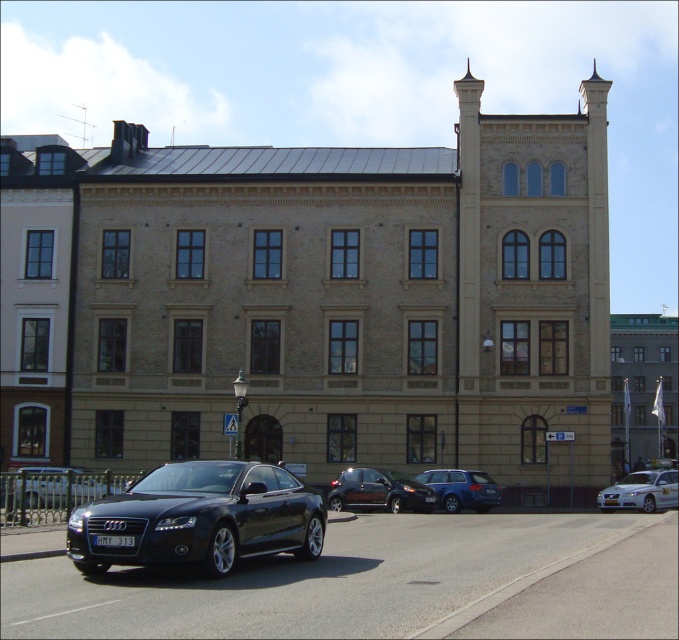
In the scene shown: You are standing in front of the building and want to take a photo. You notice two points marked on the building wall. The first point is at coordinates point (52, 497) and the second is at point (458, 481). Which point will appear larger in your photo?

The point at point (52, 497) will appear larger in the photo because it is closer to the camera than point (458, 481).

You are a delivery person standing at the entrance of the building. You need to park your 3.5 meter long delivery van between the silver metallic sedan at lower right and the satin blue station wagon at center. Is there enough space to park your van there?

The distance between the silver metallic sedan at lower right and the satin blue station wagon at center is 5.61 meters. Since your van is 3.5 meters long, there is sufficient space to park between them as the available space is longer than the van.